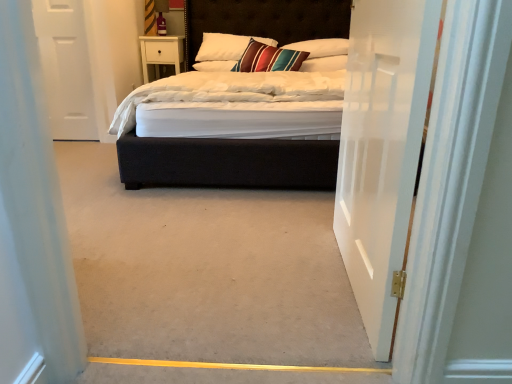
This screenshot has width=512, height=384. Identify the location of white glossy door at center, the 1th door positioned from the front. (382, 150).

What do you see at coordinates (324, 64) in the screenshot? This screenshot has width=512, height=384. I see `white soft pillow at upper center, which ranks as the fourth pillow in left-to-right order` at bounding box center [324, 64].

Locate an element on the screen. white soft pillow at upper center, acting as the 2th pillow starting from the right is located at coordinates (321, 47).

Find the location of `velvet black bed at center`. velvet black bed at center is located at coordinates (227, 164).

Do you think white soft pillow at upper center, acting as the 1th pillow starting from the right, is within velvet-like multicolored pillow at center, which appears as the 3th pillow when viewed from the right, or outside of it?

white soft pillow at upper center, acting as the 1th pillow starting from the right, lies outside velvet-like multicolored pillow at center, which appears as the 3th pillow when viewed from the right.

Is point (324, 67) closer or farther from the camera than point (231, 51)?

Point (324, 67) is closer to the camera than point (231, 51).

Considering the relative positions of white soft pillow at upper center, which ranks as the fourth pillow in left-to-right order, and velvet-like multicolored pillow at center, which is the second pillow from left to right, in the image provided, is white soft pillow at upper center, which ranks as the fourth pillow in left-to-right order, to the left of velvet-like multicolored pillow at center, which is the second pillow from left to right, from the viewer's perspective?

In fact, white soft pillow at upper center, which ranks as the fourth pillow in left-to-right order, is to the right of velvet-like multicolored pillow at center, which is the second pillow from left to right.

Considering the sizes of objects white soft pillow at upper center, acting as the 1th pillow starting from the right, and velvet-like multicolored pillow at center, which appears as the 3th pillow when viewed from the right, in the image provided, who is taller, white soft pillow at upper center, acting as the 1th pillow starting from the right, or velvet-like multicolored pillow at center, which appears as the 3th pillow when viewed from the right,?

velvet-like multicolored pillow at center, which appears as the 3th pillow when viewed from the right, is taller.

Between white soft pillow at upper center, acting as the 2th pillow starting from the right, and white soft pillow at upper center, which ranks as the fourth pillow in left-to-right order, which one has less height?

white soft pillow at upper center, which ranks as the fourth pillow in left-to-right order.

Who is bigger, white soft pillow at upper center, acting as the 2th pillow starting from the right, or white soft pillow at upper center, which ranks as the fourth pillow in left-to-right order?

With larger size is white soft pillow at upper center, acting as the 2th pillow starting from the right.

Is white soft pillow at upper center, which appears as the 3th pillow when viewed from the left, spatially inside white soft pillow at upper center, acting as the 1th pillow starting from the right, or outside of it?

The correct answer is: outside.

From the image's perspective, is white soft pillow at upper center, acting as the 2th pillow starting from the right, on top of white soft pillow at upper center, which ranks as the fourth pillow in left-to-right order?

Yes, from the image's perspective, white soft pillow at upper center, acting as the 2th pillow starting from the right, is over white soft pillow at upper center, which ranks as the fourth pillow in left-to-right order.

Between white matte door at left, placed as the 1th door when sorted from left to right, and white soft pillow at center, which is counted as the fourth pillow, starting from the right, which one is positioned in front?

white matte door at left, placed as the 1th door when sorted from left to right, is in front.

How far apart are white matte door at left, the 1th door viewed from the back, and white soft pillow at center, which is counted as the fourth pillow, starting from the right?

white matte door at left, the 1th door viewed from the back, and white soft pillow at center, which is counted as the fourth pillow, starting from the right, are 1.03 meters apart.

Which point is more forward, (53, 72) or (223, 69)?

Positioned in front is point (53, 72).

From their relative heights in the image, would you say white matte door at left, placed as the 1th door when sorted from left to right, is taller or shorter than white soft pillow at center, which is counted as the fourth pillow, starting from the right?

Clearly, white matte door at left, placed as the 1th door when sorted from left to right, is taller compared to white soft pillow at center, which is counted as the fourth pillow, starting from the right.

Is white soft pillow at upper center, acting as the 2th pillow starting from the right, positioned far away from white soft pillow at center, the 1th pillow positioned from the left?

white soft pillow at upper center, acting as the 2th pillow starting from the right, is actually quite close to white soft pillow at center, the 1th pillow positioned from the left.

From the image's perspective, is white soft pillow at upper center, which appears as the 3th pillow when viewed from the left, beneath white soft pillow at center, which is counted as the fourth pillow, starting from the right?

No, from the image's perspective, white soft pillow at upper center, which appears as the 3th pillow when viewed from the left, is not beneath white soft pillow at center, which is counted as the fourth pillow, starting from the right.

Locate an element on the screen. the 2nd pillow in front of the white soft pillow at center, the 1th pillow positioned from the left is located at coordinates tap(321, 47).

Between white matte door at left, the 1th door viewed from the back, and white soft pillow at upper center, acting as the 2th pillow starting from the right, which one appears on the right side from the viewer's perspective?

Positioned to the right is white soft pillow at upper center, acting as the 2th pillow starting from the right.

This screenshot has height=384, width=512. Identify the location of the 2nd pillow behind the white matte door at left, the 2th door in the right-to-left sequence. (321, 47).

Is point (41, 32) positioned in front of point (317, 54)?

Yes, it is in front of point (317, 54).

Is white matte door at left, placed as the 1th door when sorted from left to right, looking in the opposite direction of white soft pillow at upper center, which appears as the 3th pillow when viewed from the left?

No, white matte door at left, placed as the 1th door when sorted from left to right, is not facing the opposite direction of white soft pillow at upper center, which appears as the 3th pillow when viewed from the left.

Between velvet black bed at center and white matte door at left, placed as the 1th door when sorted from left to right, which one has larger width?

Wider between the two is velvet black bed at center.

From a real-world perspective, is velvet black bed at center physically below white matte door at left, the 1th door viewed from the back?

No.

Does velvet black bed at center come in front of white matte door at left, marked as the 2th door in a front-to-back arrangement?

Yes, it is.

Who is smaller, velvet black bed at center or white matte door at left, the 2th door in the right-to-left sequence?

→ Smaller between the two is white matte door at left, the 2th door in the right-to-left sequence.

Is velvet black bed at center oriented away from white soft pillow at upper center, which ranks as the fourth pillow in left-to-right order?

Correct, velvet black bed at center is looking away from white soft pillow at upper center, which ranks as the fourth pillow in left-to-right order.

From a real-world perspective, relative to white soft pillow at upper center, which ranks as the fourth pillow in left-to-right order, is velvet black bed at center vertically above or below?

From a real-world perspective, velvet black bed at center is physically below white soft pillow at upper center, which ranks as the fourth pillow in left-to-right order.

Considering the relative sizes of velvet black bed at center and white soft pillow at upper center, which ranks as the fourth pillow in left-to-right order, in the image provided, is velvet black bed at center wider than white soft pillow at upper center, which ranks as the fourth pillow in left-to-right order,?

Yes.

Starting from the velvet-like multicolored pillow at center, which appears as the 3th pillow when viewed from the right, which pillow is the 2nd one to the right? Please provide its 2D coordinates.

[(324, 64)]

Identify the location of the 1st pillow directly beneath the white soft pillow at upper center, which appears as the 3th pillow when viewed from the left (from a real-world perspective). (324, 64).

From the image, which object appears to be farther from velvet black bed at center, white soft pillow at center, the 1th pillow positioned from the left, or white matte door at left, the 1th door viewed from the back?

white matte door at left, the 1th door viewed from the back, lies further to velvet black bed at center than the other object.

Estimate the real-world distances between objects in this image. Which object is closer to velvet-like multicolored pillow at center, which is the second pillow from left to right, velvet black bed at center or white soft pillow at upper center, acting as the 2th pillow starting from the right?

Among the two, velvet black bed at center is located nearer to velvet-like multicolored pillow at center, which is the second pillow from left to right.

Estimate the real-world distances between objects in this image. Which object is further from velvet black bed at center, white soft pillow at upper center, which appears as the 3th pillow when viewed from the left, or white soft pillow at center, which is counted as the fourth pillow, starting from the right?

The object further to velvet black bed at center is white soft pillow at center, which is counted as the fourth pillow, starting from the right.

From the image, which object appears to be nearer to white soft pillow at upper center, acting as the 2th pillow starting from the right, white matte door at left, the 2th door in the right-to-left sequence, or white soft pillow at center, which is counted as the fourth pillow, starting from the right?

white soft pillow at center, which is counted as the fourth pillow, starting from the right.

Estimate the real-world distances between objects in this image. Which object is closer to white matte door at left, marked as the 2th door in a front-to-back arrangement, white soft pillow at upper center, which appears as the 3th pillow when viewed from the left, or white soft pillow at center, which is counted as the fourth pillow, starting from the right?

Answer: white soft pillow at center, which is counted as the fourth pillow, starting from the right, is closer to white matte door at left, marked as the 2th door in a front-to-back arrangement.

Considering their positions, is white soft pillow at upper center, which appears as the 3th pillow when viewed from the left, positioned closer to white glossy door at center, the 1th door positioned from the front, than velvet-like multicolored pillow at center, which appears as the 3th pillow when viewed from the right?

Among the two, white soft pillow at upper center, which appears as the 3th pillow when viewed from the left, is located nearer to white glossy door at center, the 1th door positioned from the front.

Based on their spatial positions, is white soft pillow at center, which is counted as the fourth pillow, starting from the right, or white soft pillow at upper center, which appears as the 3th pillow when viewed from the left, further from white soft pillow at upper center, acting as the 1th pillow starting from the right?

white soft pillow at center, which is counted as the fourth pillow, starting from the right, is positioned further to the anchor white soft pillow at upper center, acting as the 1th pillow starting from the right.

Which object lies further to the anchor point white glossy door at center, which is the 2th door from left to right, white matte door at left, placed as the 1th door when sorted from left to right, or white soft pillow at upper center, which appears as the 3th pillow when viewed from the left?

white matte door at left, placed as the 1th door when sorted from left to right.

Find the location of `bed between white glossy door at center, which is the 2th door from left to right, and white soft pillow at upper center, acting as the 2th pillow starting from the right, in the front-back direction`. bed between white glossy door at center, which is the 2th door from left to right, and white soft pillow at upper center, acting as the 2th pillow starting from the right, in the front-back direction is located at coordinates (227, 164).

At what (x,y) coordinates should I click in order to perform the action: click on bed between white glossy door at center, which is the 2th door from left to right, and white matte door at left, placed as the 1th door when sorted from left to right, along the z-axis. Please return your answer as a coordinate pair (x, y). This screenshot has height=384, width=512. Looking at the image, I should click on (227, 164).

Image resolution: width=512 pixels, height=384 pixels. Identify the location of door between velvet black bed at center and white soft pillow at center, which is counted as the fourth pillow, starting from the right, along the z-axis. (66, 68).

Find the location of a particular element. pillow between white matte door at left, the 2th door in the right-to-left sequence, and velvet-like multicolored pillow at center, which appears as the 3th pillow when viewed from the right, in the horizontal direction is located at coordinates coord(215,66).